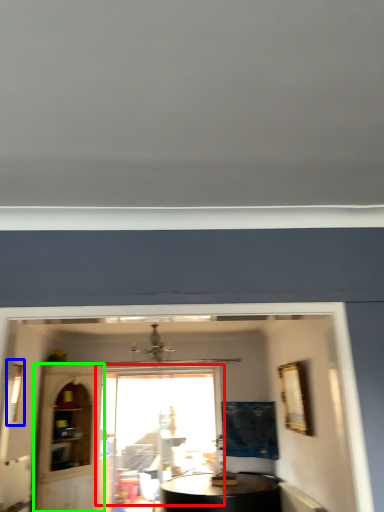
Question: Which is farther away from window (highlighted by a red box)? window (highlighted by a blue box) or glass door (highlighted by a green box)?

Choices:
 (A) window
 (B) glass door

Answer: (A)